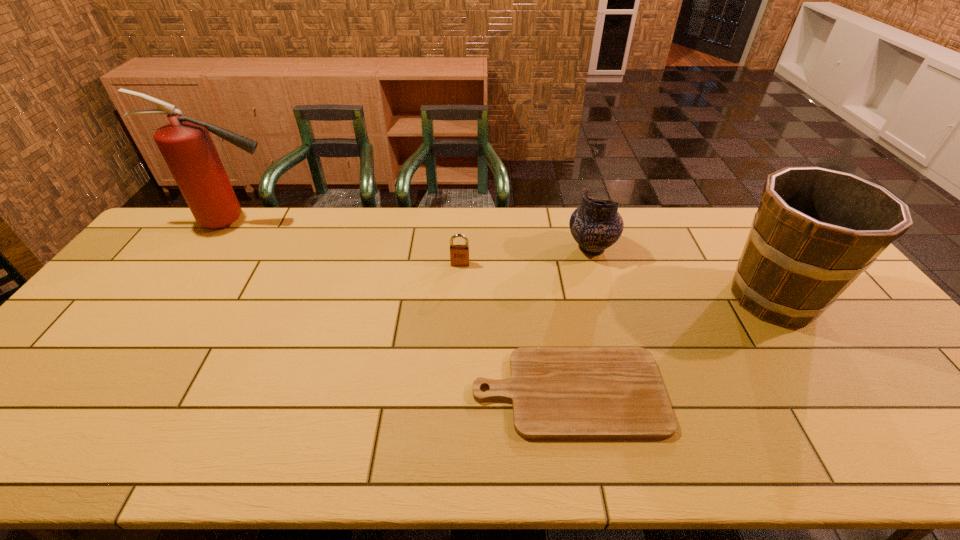
At what (x,y) coordinates should I click in order to perform the action: click on vacant space in between the tallest object and the pottery. Please return your answer as a coordinate pair (x, y). The image size is (960, 540). Looking at the image, I should click on (412, 235).

The width and height of the screenshot is (960, 540). I want to click on unoccupied position between the second shortest object and the second tallest object, so click(x=616, y=281).

This screenshot has height=540, width=960. I want to click on free space that is in between the pottery and the fourth tallest object, so click(526, 256).

Identify the location of the fourth closest object to the chopping board. (185, 143).

Locate an element on the screen. the closest object relative to the shortest object is located at coordinates (816, 230).

I want to click on free space that satisfies the following two spatial constraints: 1. at the nozzle of the pottery; 2. on the right side of the fire extinguisher, so click(215, 248).

What are the coordinates of `vacant region that satisfies the following two spatial constraints: 1. at the nozzle of the third tallest object; 2. on the right side of the leftmost object` in the screenshot? It's located at (215, 248).

You are a GUI agent. You are given a task and a screenshot of the screen. Output one action in this format:
    pyautogui.click(x=<x>, y=<y>)
    Task: Click on the vacant space that satisfies the following two spatial constraints: 1. on the back side of the nearest object; 2. at the nozzle of the leftmost object
    This screenshot has height=540, width=960.
    Given the screenshot: What is the action you would take?
    [540, 221]

At what (x,y) coordinates should I click in order to perform the action: click on free space that satisfies the following two spatial constraints: 1. at the nozzle of the fire extinguisher; 2. on the right side of the nearest object. Please return your answer as a coordinate pair (x, y). Looking at the image, I should click on (115, 392).

Where is `vacant area in the image that satisfies the following two spatial constraints: 1. at the nozzle of the tallest object; 2. on the back side of the rightmost object`? The height and width of the screenshot is (540, 960). vacant area in the image that satisfies the following two spatial constraints: 1. at the nozzle of the tallest object; 2. on the back side of the rightmost object is located at coordinates (180, 298).